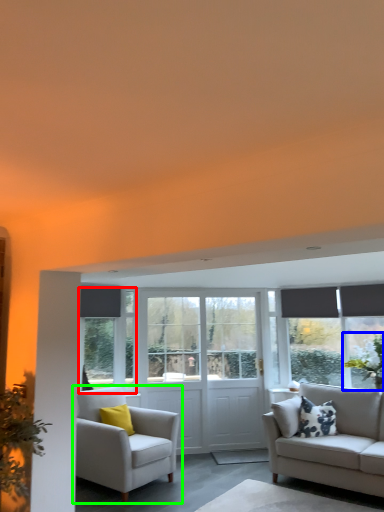
Question: Which is farther away from window (highlighted by a red box)? plant (highlighted by a blue box) or chair (highlighted by a green box)?

Choices:
 (A) plant
 (B) chair

Answer: (A)